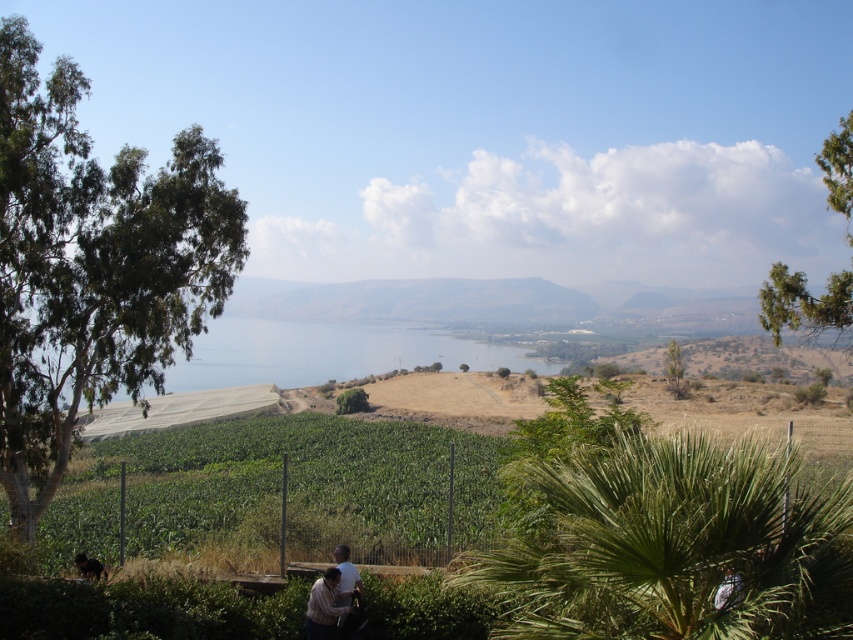
You are standing at the edge of the cornfield and want to walk to the green leafy palm at center and the green leafy tree at center. Which one is closer to you?

The green leafy palm at center is 78.06 meters away from the green leafy tree at center. However, without knowing your exact position relative to both, I cannot determine which is closer. Please provide more information about your location.